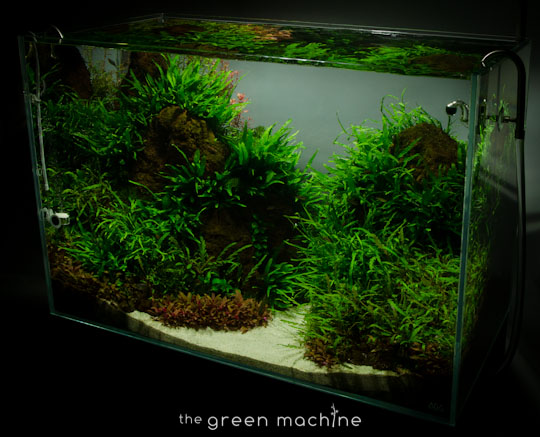
Find the location of a particular element. This screenshot has width=540, height=437. suction cup is located at coordinates (501, 122).